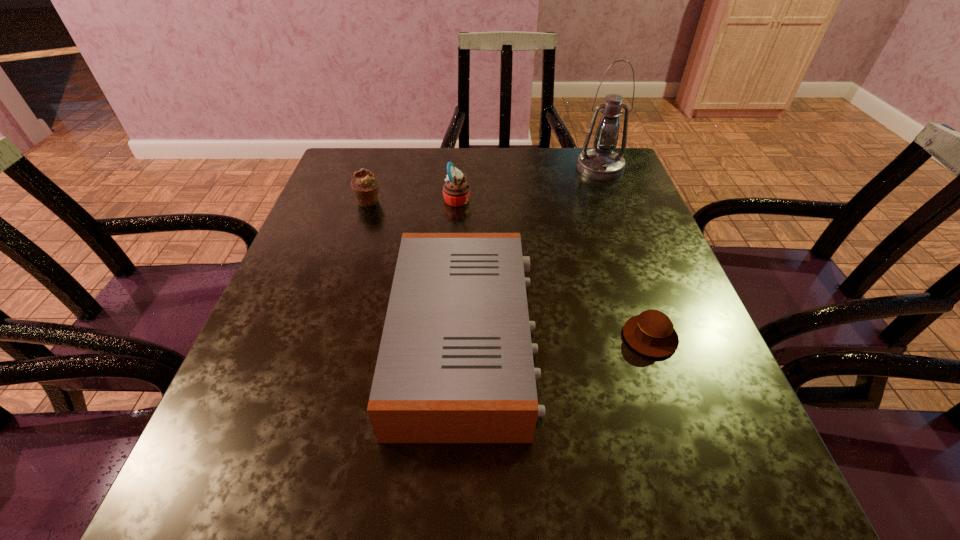
Identify the location of vacant region at the left edge of the desktop. pos(328,285).

Where is `vacant space at the right edge of the desktop`? The width and height of the screenshot is (960, 540). vacant space at the right edge of the desktop is located at coordinates (665, 406).

In the image, there is a desktop. Where is `vacant space at the near left corner`? Image resolution: width=960 pixels, height=540 pixels. vacant space at the near left corner is located at coordinates (271, 499).

In order to click on vacant position at the far right corner of the desktop in this screenshot , I will do `click(590, 179)`.

This screenshot has width=960, height=540. I want to click on vacant space at the near right corner of the desktop, so click(716, 473).

Locate an element on the screen. The height and width of the screenshot is (540, 960). vacant point located between the leftmost muffin and the farthest object is located at coordinates (485, 184).

Where is `empty location between the radio receiver and the rightmost muffin`? The width and height of the screenshot is (960, 540). empty location between the radio receiver and the rightmost muffin is located at coordinates tap(558, 339).

The width and height of the screenshot is (960, 540). Identify the location of unoccupied area between the rightmost muffin and the farthest object. (625, 252).

Find the location of a particular element. vacant point located between the tallest object and the radio receiver is located at coordinates (533, 254).

This screenshot has height=540, width=960. I want to click on vacant space in between the farthest object and the shortest object, so click(x=625, y=252).